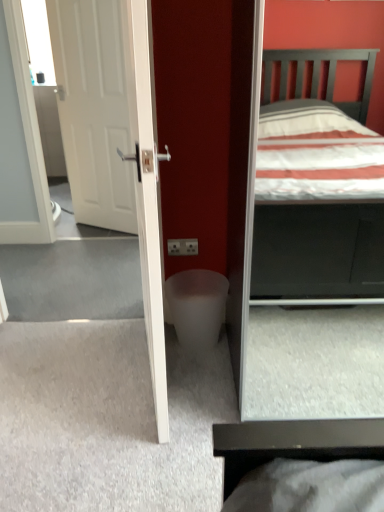
Identify the location of vacant space underneath white frosted glass at center (from a real-world perspective). (203, 356).